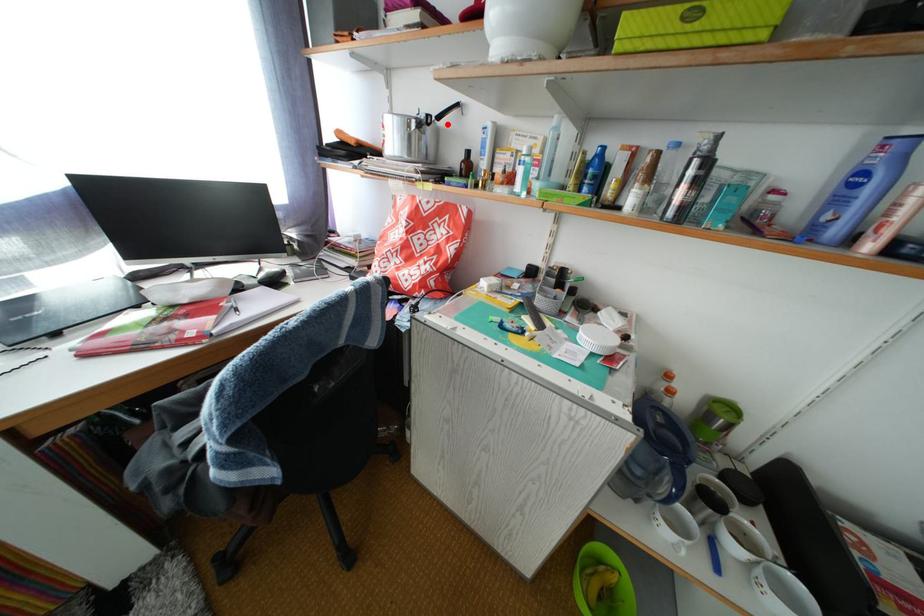
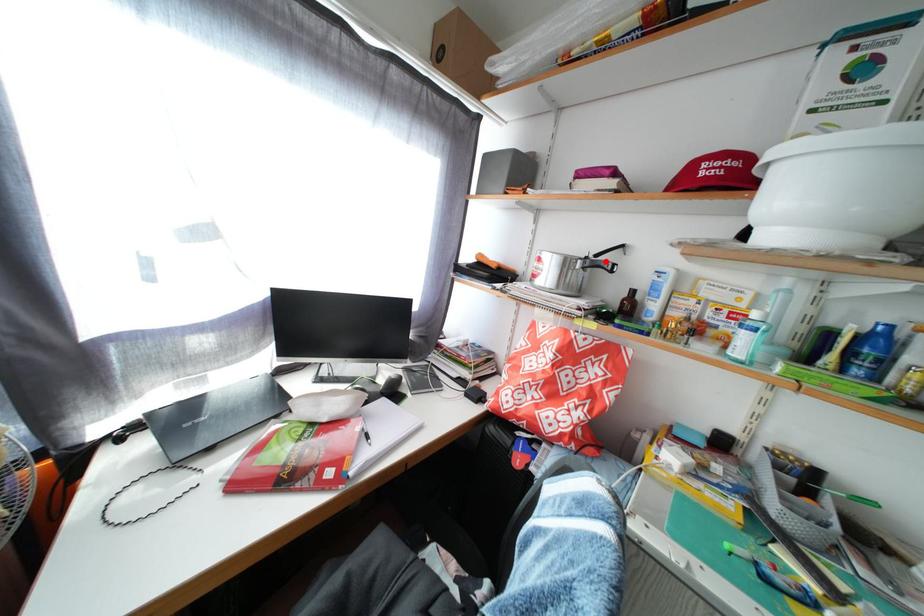
I am providing you with two images of the same scene from different viewpoints. A red point is marked on the first image and another point is marked on the second image. Do the highlighted points in image1 and image2 indicate the same real-world spot?

Yes